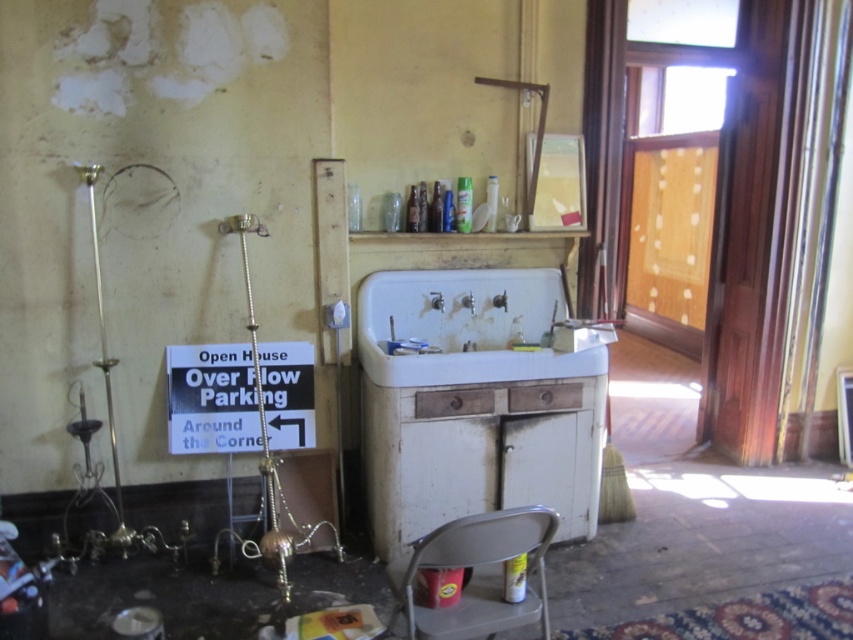
You are standing in the abandoned room and want to move from the wooden shelf above the sink to the sign pointing towards overflow parking. Which point, point (376, 346) or point (236, 449), is closer to your current position?

Point (236, 449) is closer to your current position because it is closer to the viewer than point (376, 346).

You are a painter who needs to set up an easel in this room. The easel requires a space that is at least as large as the white porcelain sink at center. Can the metallic gray chair at lower center provide enough space for the easel?

The white porcelain sink at center has a larger size compared to the metallic gray chair at lower center. Therefore, the metallic gray chair at lower center cannot provide enough space for the easel since it is smaller than the sink.

You are a contractor assessing the room. You need to determine if the black paper sign at lower left can be placed on the white porcelain sink at center without blocking the faucets. Can it fit vertically?

The white porcelain sink at center is taller than the black paper sign at lower left, so it can fit vertically without blocking the faucets.